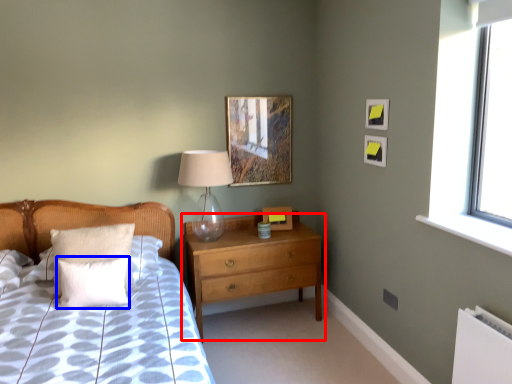
Question: Which object appears closest to the camera in this image, chest of drawers (highlighted by a red box) or pillow (highlighted by a blue box)?

Choices:
 (A) chest of drawers
 (B) pillow

Answer: (B)